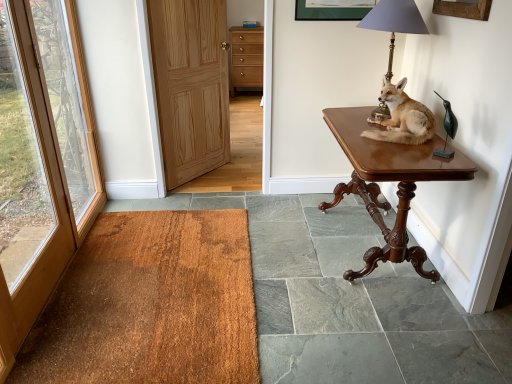
Question: From a real-world perspective, relative to brown wood door at left, the 2th door viewed from the right, is blue plastic corded phone at upper center vertically above or below?

Choices:
 (A) below
 (B) above

Answer: (B)

Question: In the image, is blue plastic corded phone at upper center on the left side or the right side of brown wood door at left, the 2th door viewed from the right?

Choices:
 (A) left
 (B) right

Answer: (B)

Question: Estimate the real-world distances between objects in this image. Which object is closer to the blue plastic corded phone at upper center?

Choices:
 (A) matte brass lamp at upper right
 (B) brown fur taxidermy fox at upper right
 (C) brown textured mat at lower left
 (D) brown wood table at right
 (E) matte wood drawers at center

Answer: (E)

Question: Which object is the closest to the brown wood door at left, the 2th door viewed from the right?

Choices:
 (A) blue plastic corded phone at upper center
 (B) light brown wood door at center, the first door positioned from the right
 (C) brown fur taxidermy fox at upper right
 (D) brown textured mat at lower left
 (E) matte brass lamp at upper right

Answer: (D)